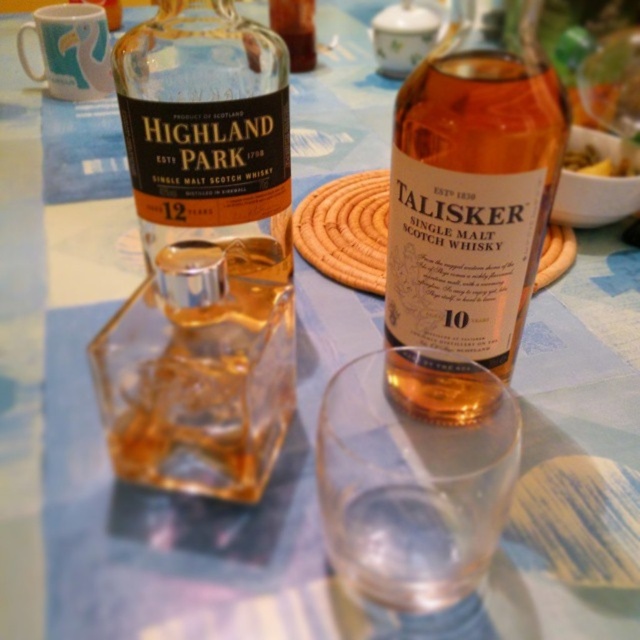
Question: Which point is closer to the camera taking this photo?

Choices:
 (A) (532, 225)
 (B) (604, 163)
 (C) (138, 173)

Answer: (A)

Question: Is matte glass bottle at center positioned behind golden crispy fries at center?

Choices:
 (A) no
 (B) yes

Answer: (A)

Question: Which of the following is the closest to the observer?

Choices:
 (A) golden crispy fries at center
 (B) amber glass bottle at center

Answer: (B)

Question: Is amber glass bottle at center smaller than golden crispy fries at center?

Choices:
 (A) no
 (B) yes

Answer: (B)

Question: Estimate the real-world distances between objects in this image. Which object is closer to the matte glass bottle at center?

Choices:
 (A) amber glass bottle at center
 (B) golden crispy fries at center

Answer: (A)

Question: Can you confirm if matte glass bottle at center is positioned to the left of amber glass bottle at center?

Choices:
 (A) yes
 (B) no

Answer: (A)